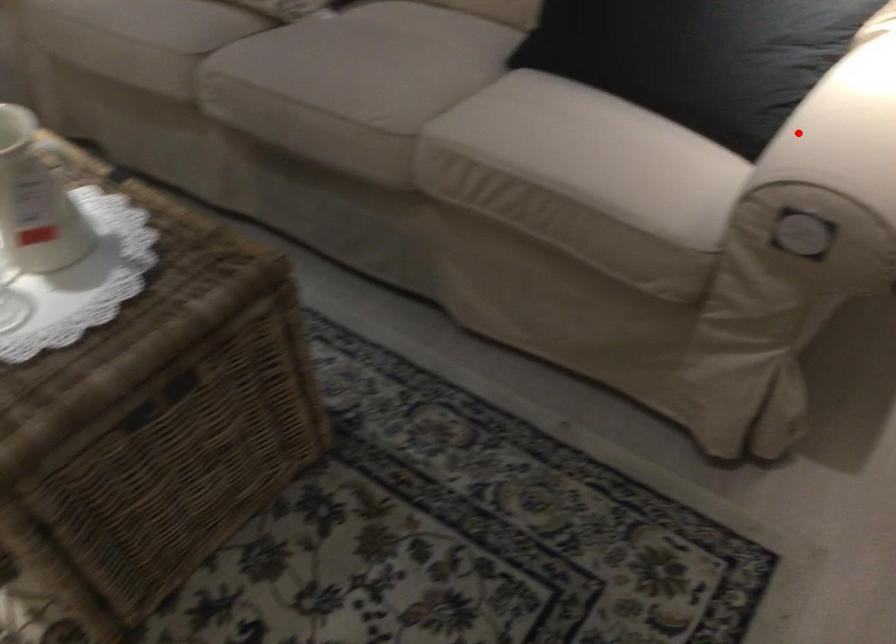
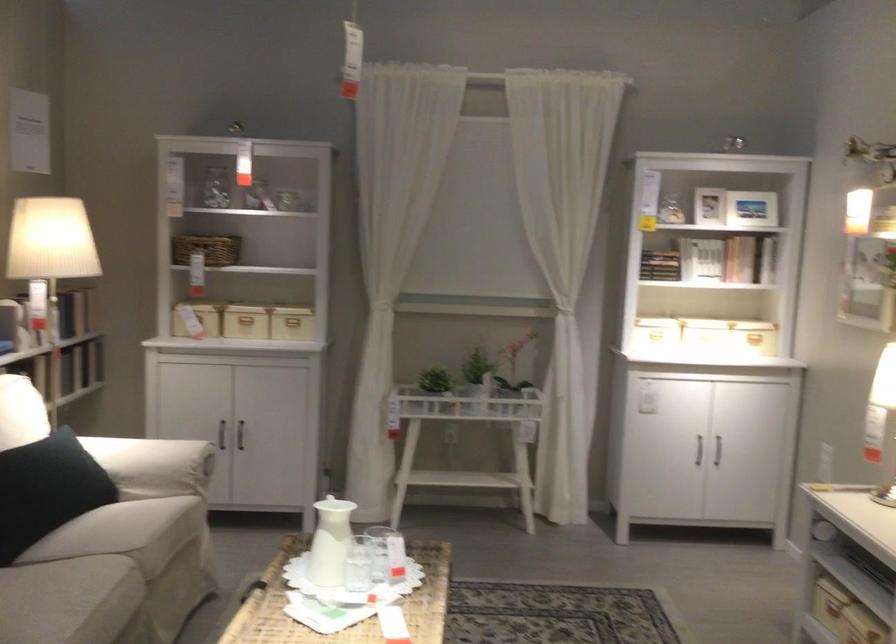
Find the pixel in the second image that matches the highlighted location in the first image.

(152, 465)